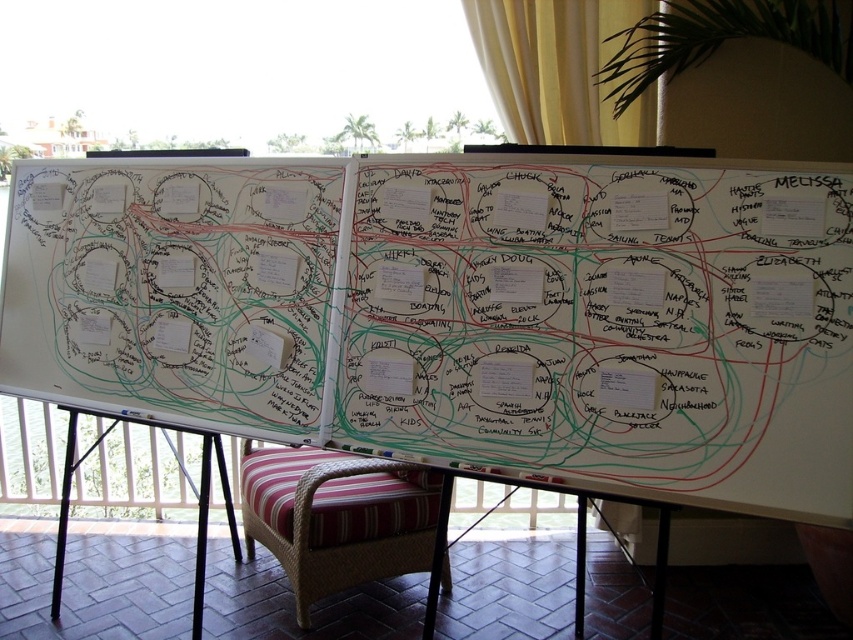
Question: Does whiteboard at center have a lesser width compared to yellow fabric curtain at upper center?

Choices:
 (A) no
 (B) yes

Answer: (A)

Question: Does whiteboard at center have a lesser width compared to yellow fabric curtain at upper center?

Choices:
 (A) yes
 (B) no

Answer: (B)

Question: Which is farther from the striped fabric cushion at lower center?

Choices:
 (A) yellow fabric curtain at upper center
 (B) whiteboard at center

Answer: (A)

Question: Among these objects, which one is nearest to the camera?

Choices:
 (A) yellow fabric curtain at upper center
 (B) whiteboard at center
 (C) striped fabric cushion at lower center

Answer: (B)

Question: From the image, what is the correct spatial relationship of whiteboard at center in relation to yellow fabric curtain at upper center?

Choices:
 (A) left
 (B) right

Answer: (A)

Question: Which point appears farthest from the camera in this image?

Choices:
 (A) coord(265,529)
 (B) coord(543,104)
 (C) coord(546,381)

Answer: (B)